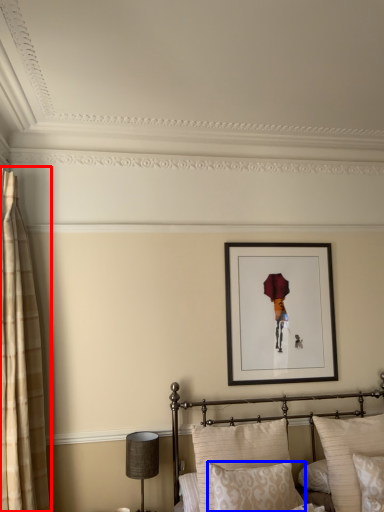
Question: Which of the following is the closest to the observer, curtain (highlighted by a red box) or pillow (highlighted by a blue box)?

Choices:
 (A) curtain
 (B) pillow

Answer: (B)